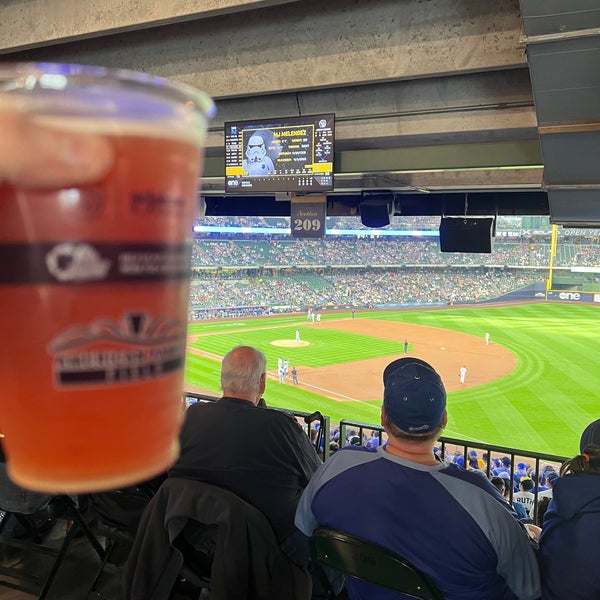
You are a GUI agent. You are given a task and a screenshot of the screen. Output one action in this format:
    pyautogui.click(x=<x>, y=<y>)
    Task: Click on the screws on back of chair
    The width and height of the screenshot is (600, 600).
    Given the screenshot: What is the action you would take?
    pyautogui.click(x=418, y=589), pyautogui.click(x=326, y=557)